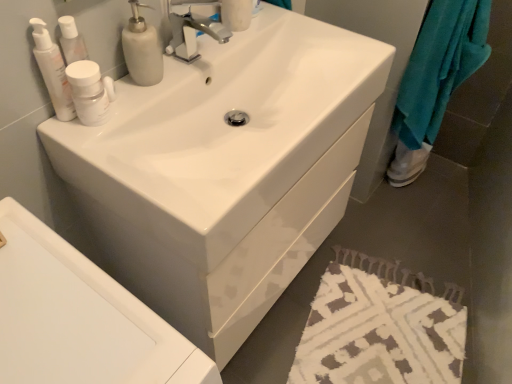
Find the location of a particular element. The height and width of the screenshot is (384, 512). free space in front of white glossy bottle at upper left, which is the first mouthwash from left to right is located at coordinates (83, 148).